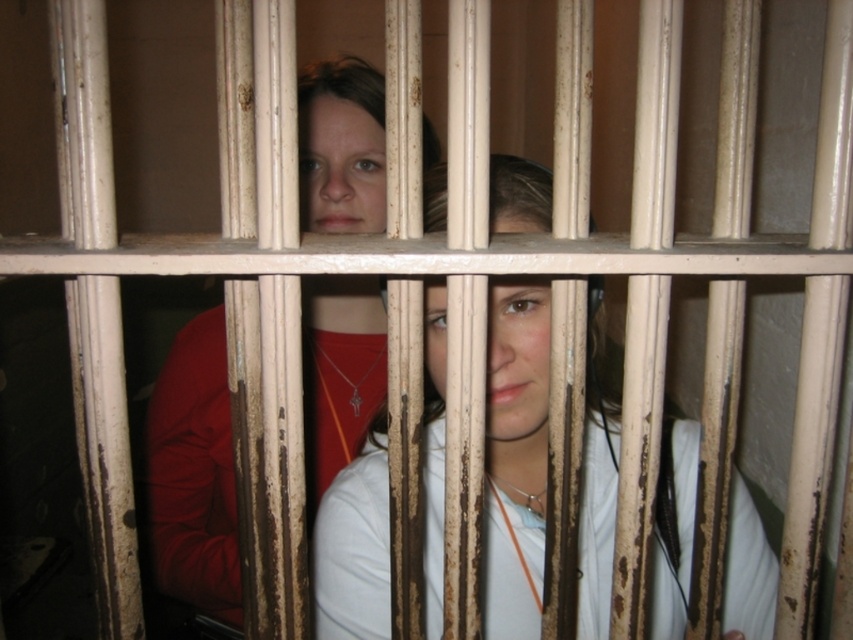
Based on the photo, you are a photographer trying to capture a clear shot of both the white matte shirt at center and the matte red shirt at center through the jail cell bars. Since the bars are vertical, which shirt should you focus on first to ensure both are in frame without the bars obstructing their faces?

The white matte shirt at center is positioned on the right side of the matte red shirt at center. To avoid the vertical bars obstructing their faces, focus on the matte red shirt at center first, then adjust to include the white matte shirt at center without the bars crossing their faces.

Based on the scene described, which object, the white matte shirt at center or the matte red shirt at center, could potentially have a larger width when viewed from the observer perspective?

The white matte shirt at center might be wider than the matte red shirt at center according to the description provided.